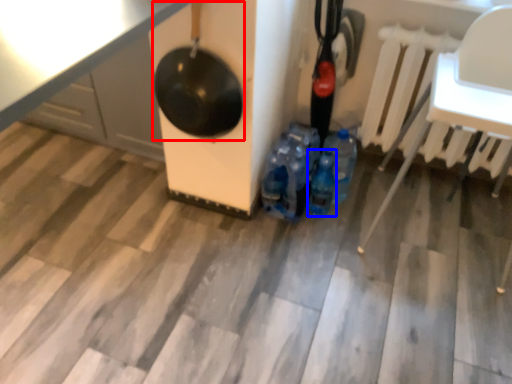
Question: Among these objects, which one is nearest to the camera, wok (highlighted by a red box) or bottle (highlighted by a blue box)?

Choices:
 (A) wok
 (B) bottle

Answer: (A)